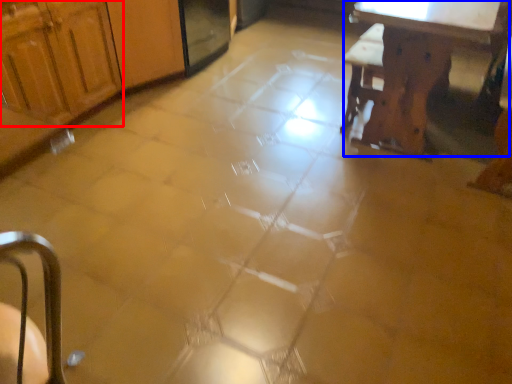
Question: Which object is further to the camera taking this photo, cabinetry (highlighted by a red box) or table (highlighted by a blue box)?

Choices:
 (A) cabinetry
 (B) table

Answer: (A)